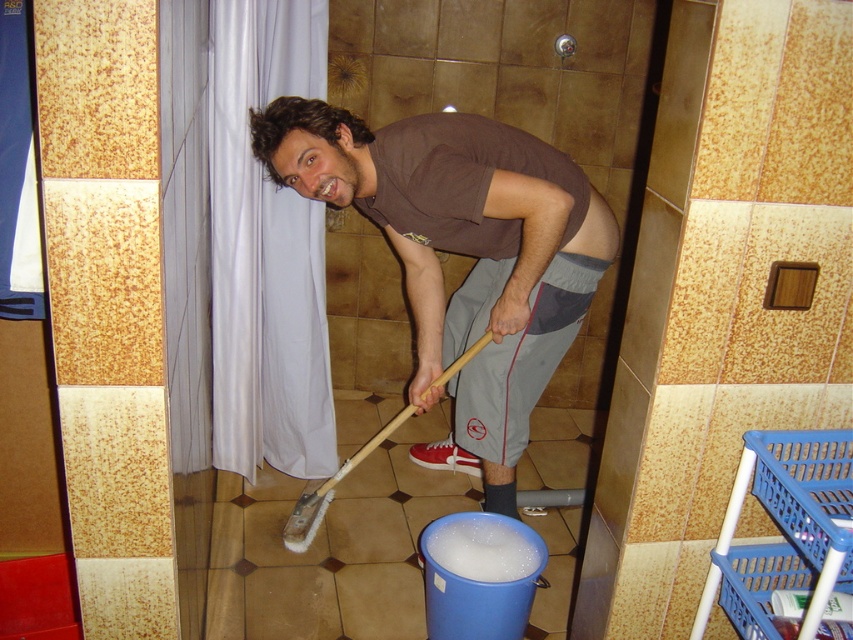
Question: Does brown cotton t-shirt at center appear under white bristle mop at lower center?

Choices:
 (A) yes
 (B) no

Answer: (B)

Question: Is brown cotton t-shirt at center below white bristle mop at lower center?

Choices:
 (A) no
 (B) yes

Answer: (A)

Question: Which point appears closest to the camera in this image?

Choices:
 (A) (442, 380)
 (B) (477, 436)

Answer: (A)

Question: Is brown cotton t-shirt at center positioned behind white bristle mop at lower center?

Choices:
 (A) no
 (B) yes

Answer: (A)

Question: Among these points, which one is farthest from the camera?

Choices:
 (A) (534, 356)
 (B) (331, 497)

Answer: (B)

Question: Which of the following is the closest to the observer?

Choices:
 (A) white bristle mop at lower center
 (B) brown cotton t-shirt at center

Answer: (B)